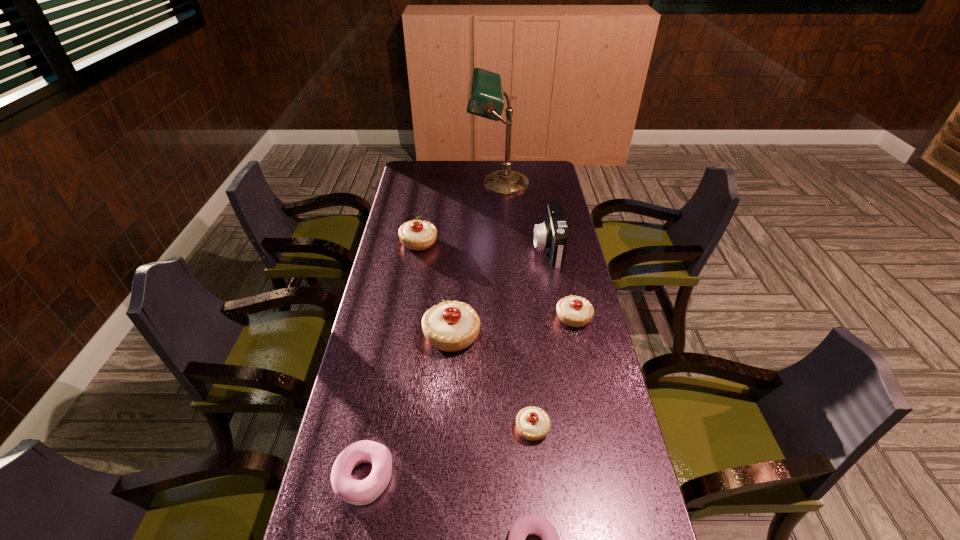
The width and height of the screenshot is (960, 540). I want to click on beige pastry that stands as the closest to the farther pink pastry, so click(450, 326).

The width and height of the screenshot is (960, 540). In order to click on pink pastry that stands as the closest to the black camcorder in this screenshot , I will do `click(357, 492)`.